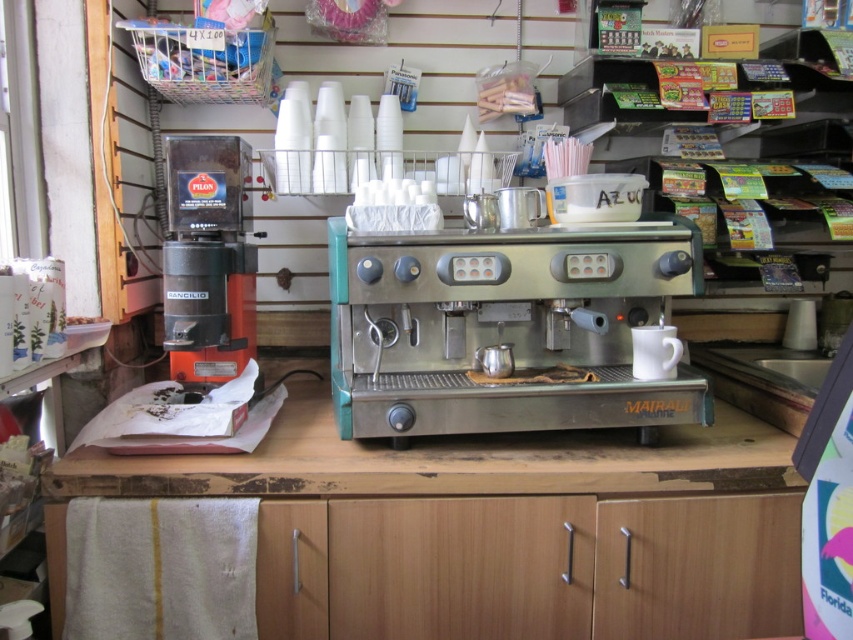
You are a barista trying to reach two points in the coffee shop setup. The first point is at coordinate point (590, 336) and the second is at point (753, 468). Which point is closer to you?

Point (590, 336) is further to the camera than point (753, 468). Therefore, point (753, 468) is closer to you.

Looking at this image, you are a barista working in this coffee shop and need to place a new menu board. The menu board is 1 meter tall. You have to decide between placing it above the stainless steel espresso machine at center or the orange matte coffee machine at left. Which machine should you choose to ensure the menu board fits vertically without being too cramped?

The stainless steel espresso machine at center is shorter than the orange matte coffee machine at left, so placing the menu board above the orange matte coffee machine at left would provide more vertical space, ensuring it isn fits without being cramped.